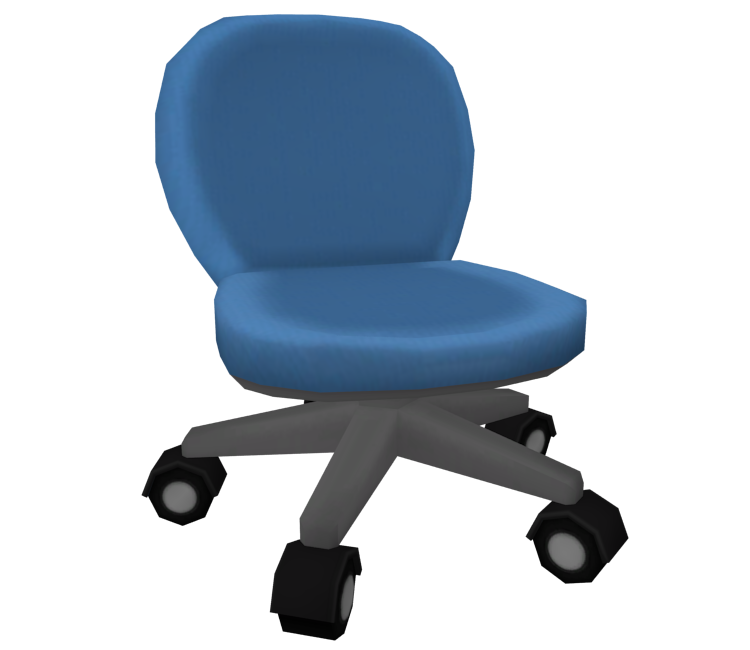
Where is `blue backing on chair`? This screenshot has width=750, height=650. blue backing on chair is located at coordinates (316, 196).